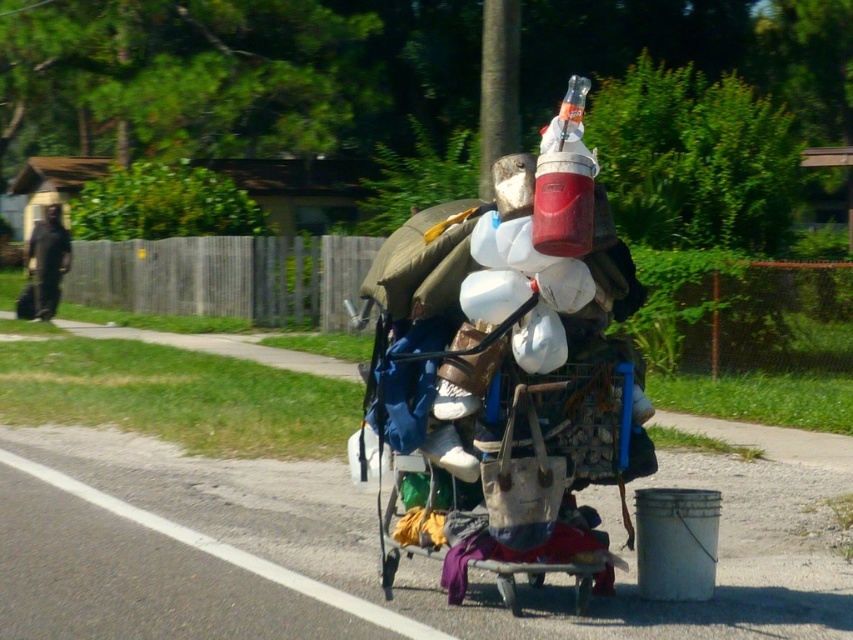
You are a delivery person trying to park your bike between the rusty metal cart at center and the black fabric bag at left. Can you fit your bike there if it requires 1.2 meters of space?

The rusty metal cart at center occupies less space than black fabric bag at left, but without knowing the exact dimensions of either, it is impossible to determine if the space between them is sufficient for a bike requiring 1.2 meters.

Where is the rusty metal cart at center located in the image?

The rusty metal cart at center is located at point (x=520, y=476) in the image.

You are standing on the sidewalk and see the rusty metal cart at center. If you want to pick up an item from the cart, how many steps do you need to take to reach it?

The rusty metal cart at center is 25.30 feet away from you. Assuming an average step length of 2.5 feet, you would need to take approximately 10 steps to reach it.